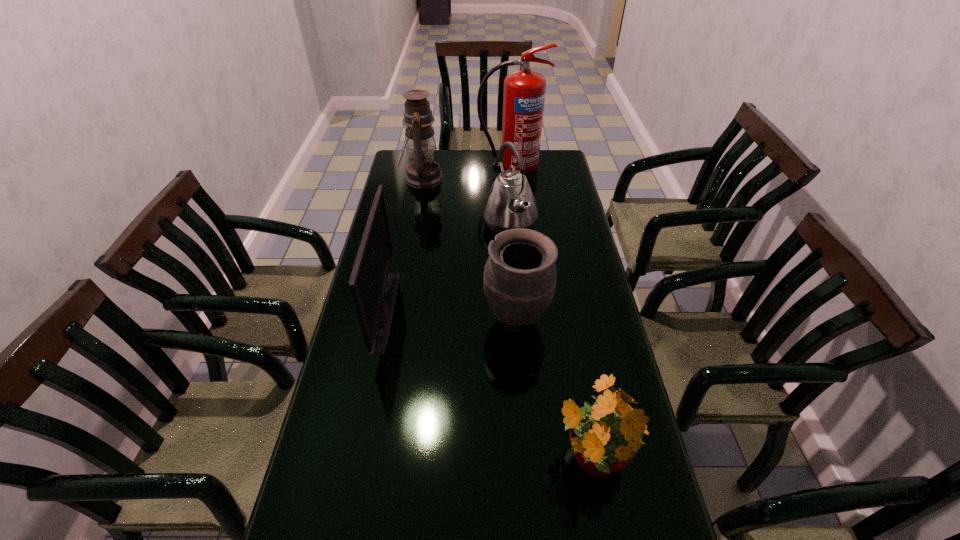
You are a GUI agent. You are given a task and a screenshot of the screen. Output one action in this format:
    pyautogui.click(x=<x>, y=<y>)
    Task: Click on the vacant space that satisfies the following two spatial constraints: 1. on the surface of the flowerpot; 2. on the left side of the tallest object
    This screenshot has height=540, width=960.
    Given the screenshot: What is the action you would take?
    pyautogui.click(x=537, y=458)

Locate an element on the screen. free space that satisfies the following two spatial constraints: 1. on the front-facing side of the urn; 2. on the left side of the monitor is located at coordinates (384, 320).